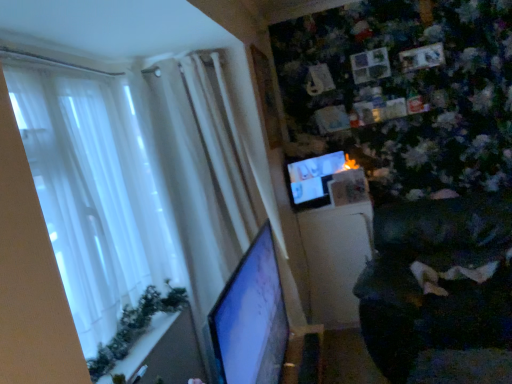
Question: From a real-world perspective, is dark fabric swivel chair at lower right physically above matte black monitor at center, positioned as the 1th computer monitor in top-to-bottom order?

Choices:
 (A) yes
 (B) no

Answer: (B)

Question: From the image's perspective, does dark fabric swivel chair at lower right appear lower than matte black monitor at center, arranged as the 2th computer monitor when ordered from the bottom?

Choices:
 (A) yes
 (B) no

Answer: (A)

Question: Is dark fabric swivel chair at lower right far away from matte black monitor at center, marked as the second computer monitor in a left-to-right arrangement?

Choices:
 (A) yes
 (B) no

Answer: (B)

Question: Does dark fabric swivel chair at lower right turn towards matte black monitor at center, arranged as the 2th computer monitor when ordered from the bottom?

Choices:
 (A) no
 (B) yes

Answer: (A)

Question: Can you confirm if dark fabric swivel chair at lower right is positioned to the left of matte black monitor at center, the second computer monitor in the front-to-back sequence?

Choices:
 (A) no
 (B) yes

Answer: (A)

Question: Considering the positions of matte black monitor at center, arranged as the 2th computer monitor when ordered from the bottom, and dark fabric swivel chair at lower right in the image, is matte black monitor at center, arranged as the 2th computer monitor when ordered from the bottom, wider or thinner than dark fabric swivel chair at lower right?

Choices:
 (A) thin
 (B) wide

Answer: (A)

Question: Is matte black monitor at center, positioned as the 1th computer monitor in top-to-bottom order, spatially inside dark fabric swivel chair at lower right, or outside of it?

Choices:
 (A) outside
 (B) inside

Answer: (A)

Question: Considering the positions of point (317, 193) and point (476, 283), is point (317, 193) closer or farther from the camera than point (476, 283)?

Choices:
 (A) closer
 (B) farther

Answer: (B)

Question: In the image, is matte black monitor at center, positioned as the 1th computer monitor in top-to-bottom order, positioned in front of or behind dark fabric swivel chair at lower right?

Choices:
 (A) front
 (B) behind

Answer: (B)

Question: Is matte black monitor at left, which is counted as the 1th computer monitor, starting from the bottom, wider or thinner than dark fabric swivel chair at lower right?

Choices:
 (A) thin
 (B) wide

Answer: (A)

Question: Which is correct: matte black monitor at left, the first computer monitor from the front, is inside dark fabric swivel chair at lower right, or outside of it?

Choices:
 (A) inside
 (B) outside

Answer: (B)

Question: Is matte black monitor at left, the 2th computer monitor when ordered from right to left, taller or shorter than dark fabric swivel chair at lower right?

Choices:
 (A) tall
 (B) short

Answer: (B)

Question: Considering the positions of matte black monitor at left, the 2th computer monitor when ordered from right to left, and dark fabric swivel chair at lower right in the image, is matte black monitor at left, the 2th computer monitor when ordered from right to left, bigger or smaller than dark fabric swivel chair at lower right?

Choices:
 (A) small
 (B) big

Answer: (A)

Question: Do you think matte black monitor at center, the second computer monitor in the front-to-back sequence, is within matte black monitor at left, the first computer monitor from the front, or outside of it?

Choices:
 (A) outside
 (B) inside

Answer: (A)

Question: Relative to matte black monitor at left, the 2th computer monitor when ordered from right to left, is matte black monitor at center, the first computer monitor in the right-to-left sequence, in front or behind?

Choices:
 (A) behind
 (B) front

Answer: (A)